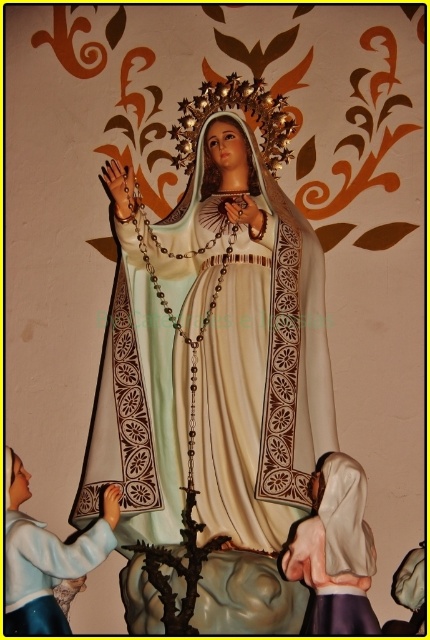
You are standing in front of the religious statue of the Virgin Mary. There are two points marked in the scene. The first point is at coordinate (211,371) and the second is at (25,524). Which point is closer to you?

Point (211,371) is further to the viewer than point (25,524). Therefore, point (25,524) is closer to you.

You are an art conservator examining the religious statue scene. You need to clean both the matte gold statue at center and the white satin robe at lower left. Which object should you clean first if you want to start with the one closer to you?

The matte gold statue at center is closer to you than the white satin robe at lower left, so you should clean the matte gold statue at center first.